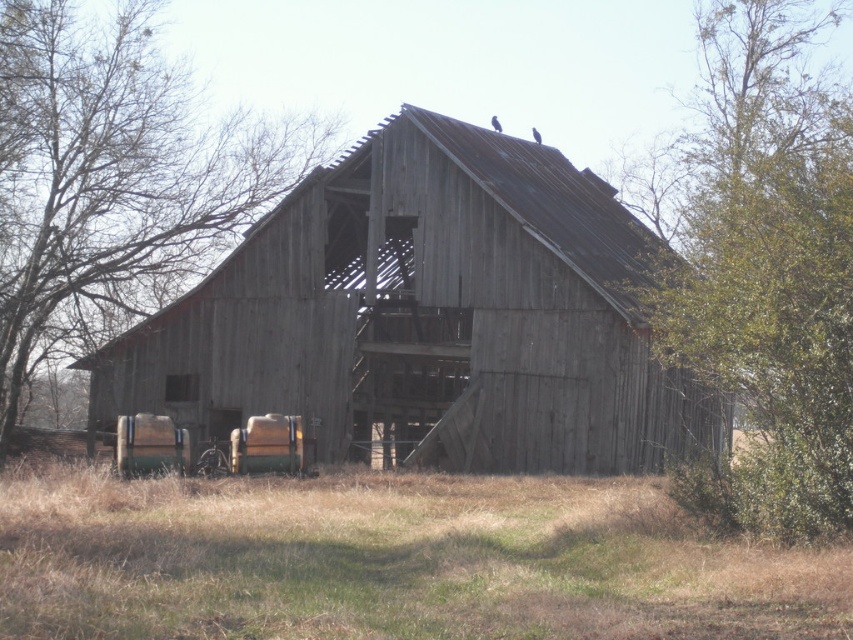
Can you confirm if green leafy tree at right is positioned above brown wood tree at left?

Indeed, green leafy tree at right is positioned over brown wood tree at left.

Between green leafy tree at right and brown wood tree at left, which one appears on the right side from the viewer's perspective?

green leafy tree at right

The image size is (853, 640). I want to click on green leafy tree at right, so click(764, 268).

Find the location of `green leafy tree at right`. green leafy tree at right is located at coordinates (764, 268).

Does weathered wood barn at center appear on the left side of brown wood tree at left?

In fact, weathered wood barn at center is to the right of brown wood tree at left.

Between weathered wood barn at center and brown wood tree at left, which one is positioned lower?

weathered wood barn at center is lower down.

Is point (265, 408) farther from camera compared to point (271, 150)?

No, it is in front of (271, 150).

Where is `weathered wood barn at center`? The image size is (853, 640). weathered wood barn at center is located at coordinates (427, 316).

Does brown grass at lower center have a lesser width compared to green leafy tree at right?

Correct, brown grass at lower center's width is less than green leafy tree at right's.

Image resolution: width=853 pixels, height=640 pixels. What do you see at coordinates (392, 561) in the screenshot?
I see `brown grass at lower center` at bounding box center [392, 561].

Locate an element on the screen. brown grass at lower center is located at coordinates (392, 561).